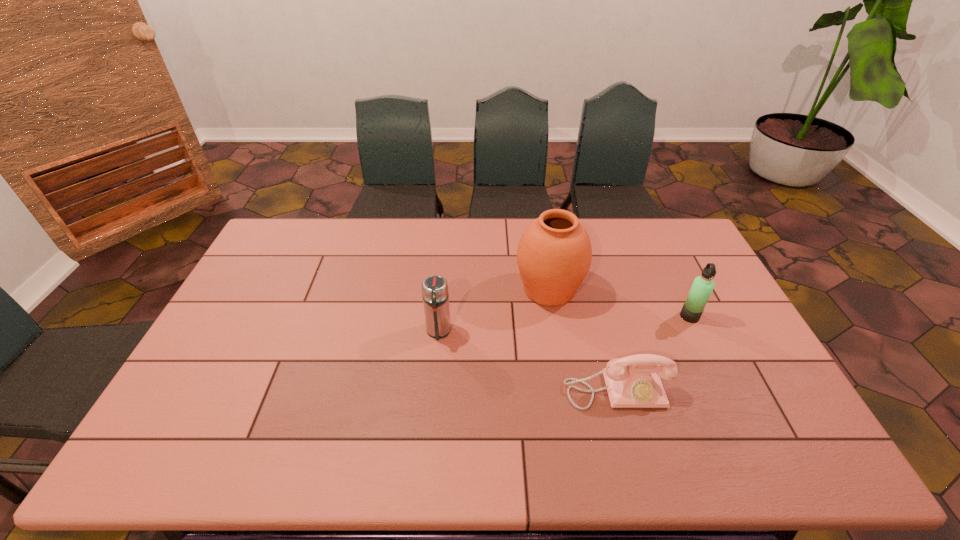
You are a GUI agent. You are given a task and a screenshot of the screen. Output one action in this format:
    pyautogui.click(x=<x>, y=<y>)
    Task: Click on the urn
    The image size is (960, 540).
    Given the screenshot: What is the action you would take?
    pyautogui.click(x=554, y=254)

Identify the location of the rightmost object. (702, 287).

Locate an element on the screen. the left thermos bottle is located at coordinates (435, 294).

The image size is (960, 540). Identify the location of telephone. (633, 381).

This screenshot has width=960, height=540. Identify the location of the shortest object. (633, 381).

Find the location of a particular element. The width and height of the screenshot is (960, 540). free space located 0.240m on the right of the tallest object is located at coordinates (657, 289).

Find the location of `vacant space located on the front of the rightmost object`. vacant space located on the front of the rightmost object is located at coordinates pyautogui.click(x=732, y=404).

Locate an element on the screen. The width and height of the screenshot is (960, 540). vacant space situated 0.100m with a handle on the side of the left thermos bottle is located at coordinates (435, 372).

Find the location of a particular element. free region located on the dial of the nearest object is located at coordinates (635, 461).

Locate an element on the screen. This screenshot has height=540, width=960. object positioned at the right edge is located at coordinates (702, 287).